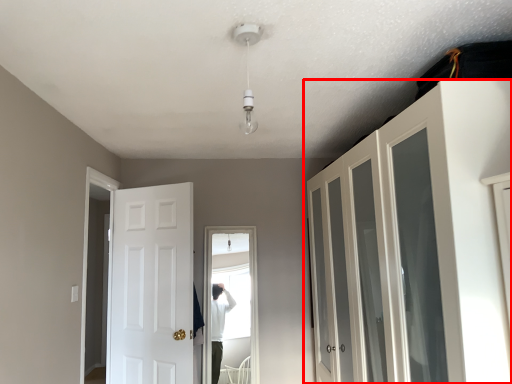
Question: From the image's perspective, what is the correct spatial relationship of cupboard (annotated by the red box) in relation to door?

Choices:
 (A) below
 (B) above

Answer: (B)